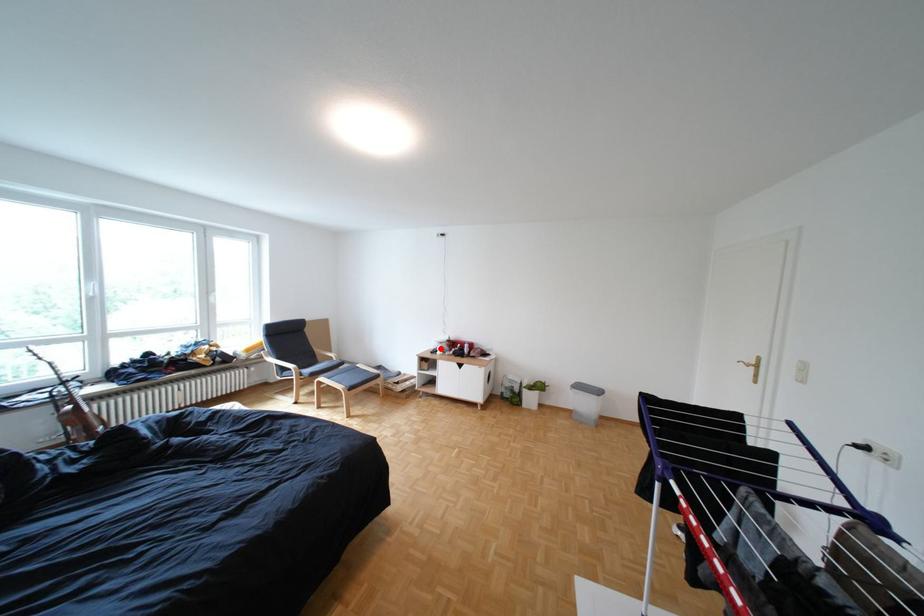
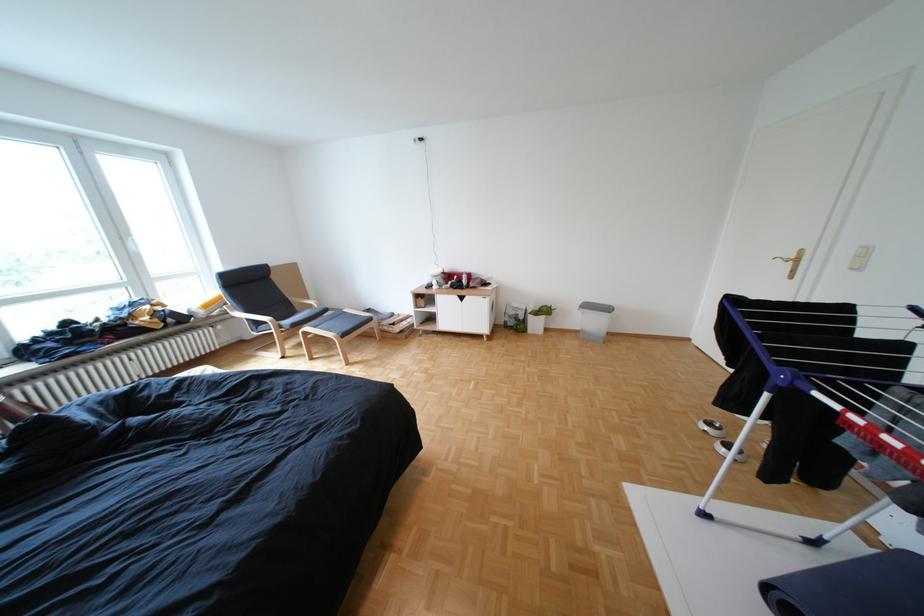
Question: I am providing you with two images of the same scene from different viewpoints. A red point is shown in image1. For the corresponding object point in image2, is it positioned nearer or farther from the camera?

Choices:
 (A) Nearer
 (B) Farther

Answer: (A)